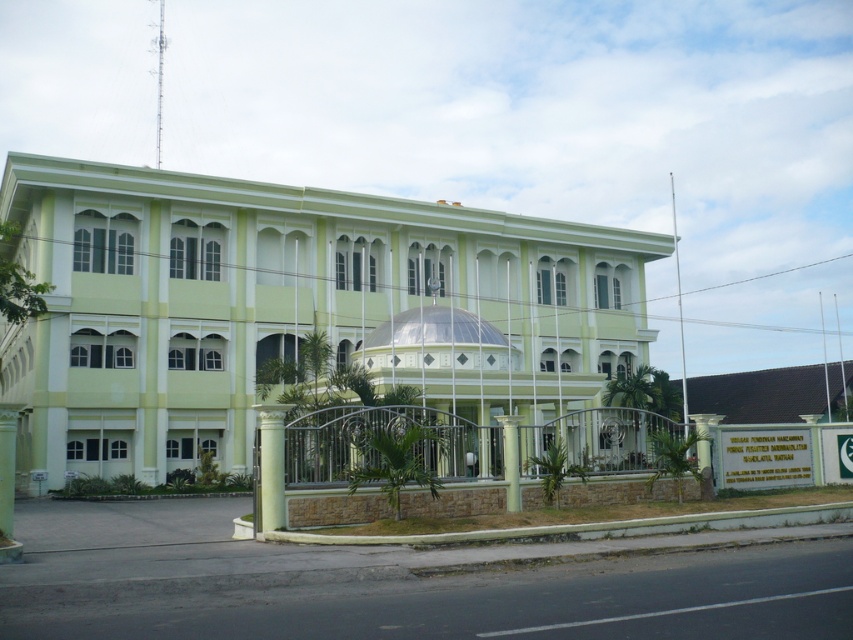
Is green polished stone column at center bigger than white marble pillar at center?

Incorrect, green polished stone column at center is not larger than white marble pillar at center.

Image resolution: width=853 pixels, height=640 pixels. What do you see at coordinates (270, 467) in the screenshot?
I see `green polished stone column at center` at bounding box center [270, 467].

Locate an element on the screen. This screenshot has height=640, width=853. green polished stone column at center is located at coordinates (270, 467).

Is light green concrete building at center wider than white marble pillar at center?

Correct, the width of light green concrete building at center exceeds that of white marble pillar at center.

Between light green concrete building at center and white marble pillar at center, which one appears on the left side from the viewer's perspective?

From the viewer's perspective, light green concrete building at center appears more on the left side.

Who is more forward, [631,282] or [509,497]?

Positioned in front is point [509,497].

Locate an element on the screen. The image size is (853, 640). light green concrete building at center is located at coordinates (292, 308).

Can you confirm if light green concrete building at center is positioned below green polished stone column at center?

Incorrect, light green concrete building at center is not positioned below green polished stone column at center.

Between point (53, 320) and point (271, 422), which one is positioned behind?

The point (53, 320) is more distant.

You are a GUI agent. You are given a task and a screenshot of the screen. Output one action in this format:
    pyautogui.click(x=<x>, y=<y>)
    Task: Click on the light green concrete building at center
    This screenshot has width=853, height=640.
    Given the screenshot: What is the action you would take?
    pyautogui.click(x=292, y=308)